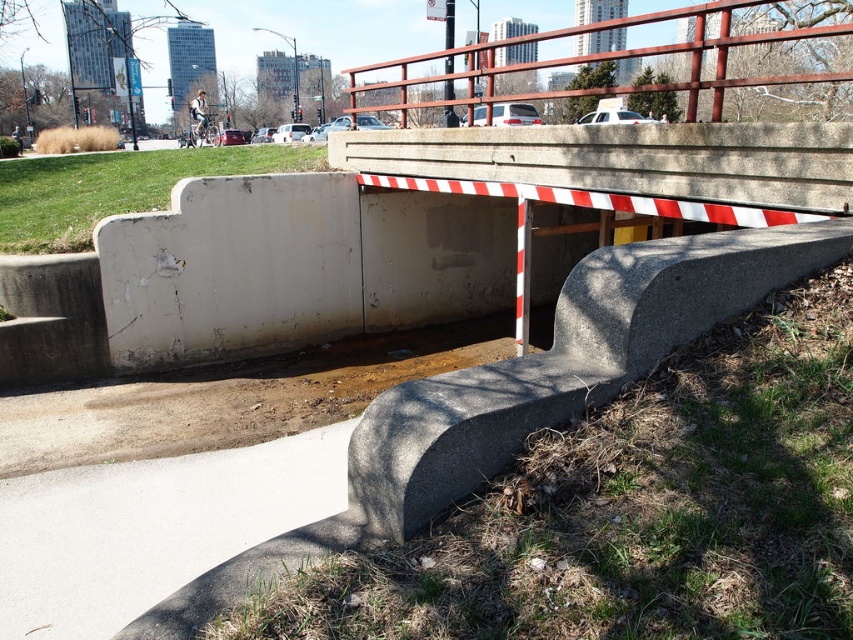
Question: Which is farther from the white striped concrete barrier at center?

Choices:
 (A) white concrete pavement at lower left
 (B) rustic wood rail at upper center

Answer: (B)

Question: Where is white concrete pavement at lower left located in relation to rustic wood rail at upper center in the image?

Choices:
 (A) left
 (B) right

Answer: (A)

Question: Among these objects, which one is farthest from the camera?

Choices:
 (A) rustic wood rail at upper center
 (B) white striped concrete barrier at center
 (C) white concrete pavement at lower left

Answer: (B)

Question: Which of the following is the farthest from the observer?

Choices:
 (A) rustic wood rail at upper center
 (B) white concrete pavement at lower left

Answer: (A)

Question: Observing the image, what is the correct spatial positioning of rustic wood rail at upper center in reference to white striped concrete barrier at center?

Choices:
 (A) right
 (B) left

Answer: (A)

Question: Does rustic wood rail at upper center appear on the right side of white striped concrete barrier at center?

Choices:
 (A) no
 (B) yes

Answer: (B)